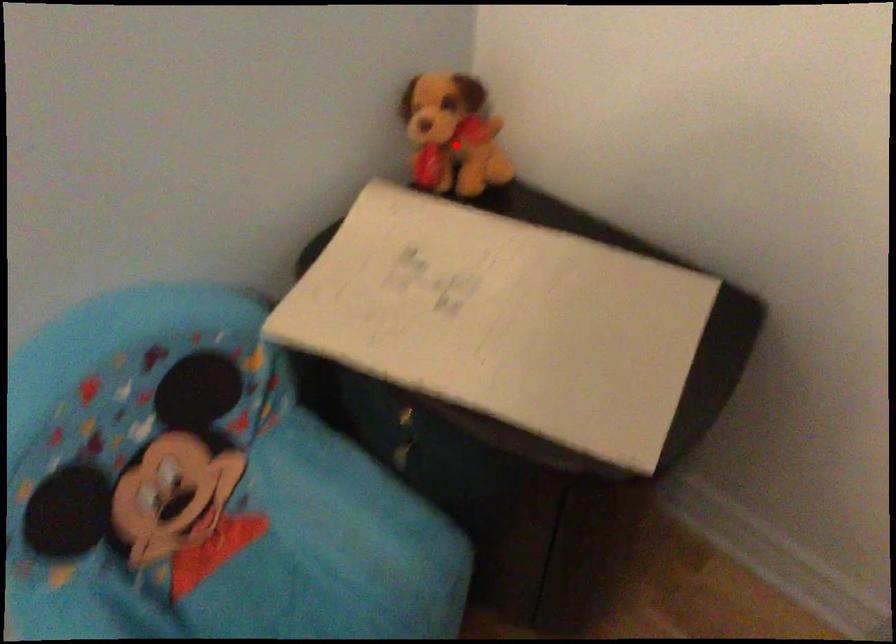
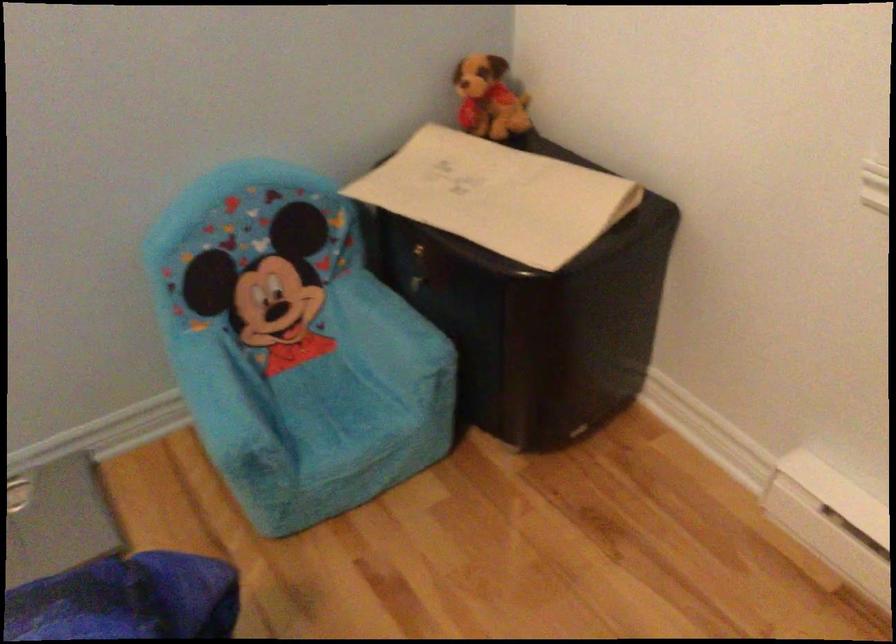
Question: I am providing you with two images of the same scene from different viewpoints. A red point is shown in image1. For the corresponding object point in image2, is it positioned nearer or farther from the camera?

Choices:
 (A) Nearer
 (B) Farther

Answer: (B)